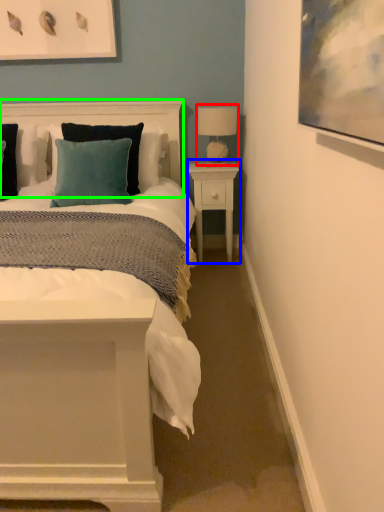
Question: Estimate the real-world distances between objects in this image. Which object is closer to table lamp (highlighted by a red box), nightstand (highlighted by a blue box) or headboard (highlighted by a green box)?

Choices:
 (A) nightstand
 (B) headboard

Answer: (A)